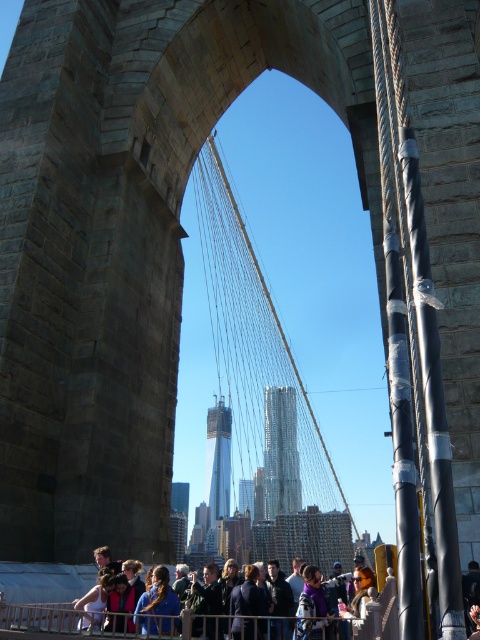
Question: Which of these objects is positioned closest to the dark blue jacket at center?

Choices:
 (A) blue fabric crowd at lower center
 (B) dark gray jacket at center

Answer: (A)

Question: Does blue fabric at center appear under dark blue jacket at center?

Choices:
 (A) yes
 (B) no

Answer: (B)

Question: Is purple fabric at center to the left of dark gray jacket at center from the viewer's perspective?

Choices:
 (A) yes
 (B) no

Answer: (B)

Question: Is blue fabric at center smaller than dark gray jacket at center?

Choices:
 (A) yes
 (B) no

Answer: (A)

Question: Which point is closer to the camera taking this photo?

Choices:
 (A) click(x=121, y=573)
 (B) click(x=166, y=621)
 (C) click(x=197, y=582)

Answer: (B)

Question: Estimate the real-world distances between objects in this image. Which object is closer to the purple fabric at center?

Choices:
 (A) dark gray jacket at center
 (B) blue fabric crowd at lower center

Answer: (B)